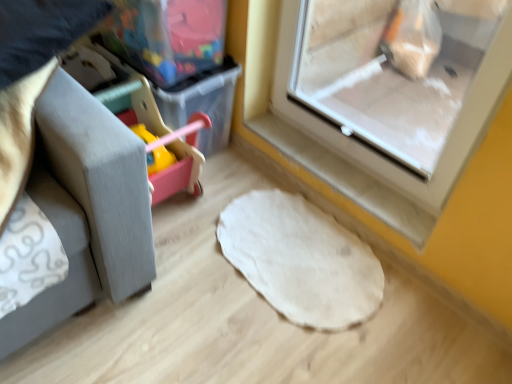
At what (x,y) coordinates should I click in order to perform the action: click on free point to the left of white felt mat at center. Please return your answer as a coordinate pair (x, y). Image resolution: width=512 pixels, height=384 pixels. Looking at the image, I should click on (177, 269).